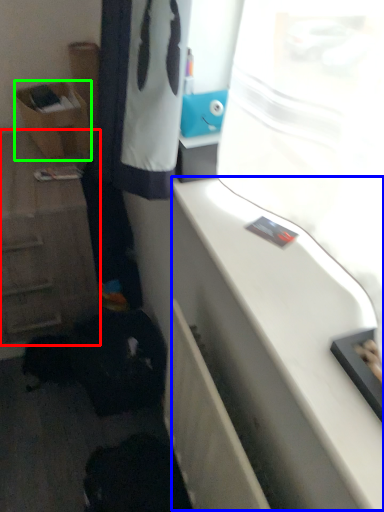
Question: Which object is the farthest from cabinetry (highlighted by a red box)? Choose among these: counter top (highlighted by a blue box) or shelf (highlighted by a green box).

Choices:
 (A) counter top
 (B) shelf

Answer: (A)